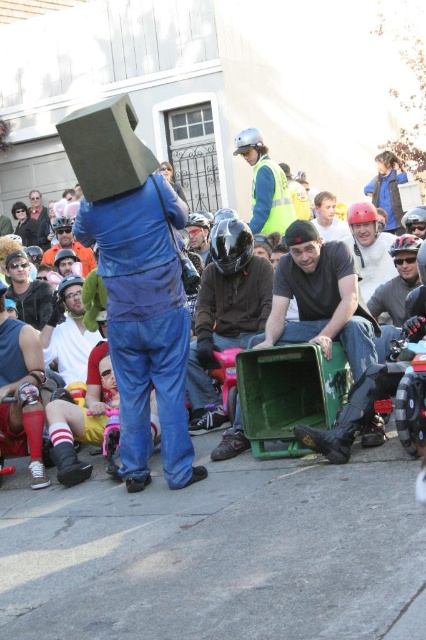
Does gray concrete pavement at lower center come in front of reflective yellow vest at upper center?

Yes.

Is gray concrete pavement at lower center to the right of reflective yellow vest at upper center from the viewer's perspective?

In fact, gray concrete pavement at lower center is to the left of reflective yellow vest at upper center.

Between point (19, 490) and point (258, 141), which one is positioned in front?

Positioned in front is point (19, 490).

Find the location of a particular element. Image resolution: width=426 pixels, height=640 pixels. gray concrete pavement at lower center is located at coordinates (218, 554).

Does red socked leg at lower left appear on the right side of reflective yellow vest at upper center?

Incorrect, red socked leg at lower left is not on the right side of reflective yellow vest at upper center.

Is the position of red socked leg at lower left more distant than that of reflective yellow vest at upper center?

That is False.

The width and height of the screenshot is (426, 640). I want to click on red socked leg at lower left, so click(20, 394).

Between matte blue jumpsuit at center and reflective yellow vest at upper center, which one has more height?

Standing taller between the two is reflective yellow vest at upper center.

Who is higher up, matte blue jumpsuit at center or reflective yellow vest at upper center?

Positioned higher is reflective yellow vest at upper center.

Who is more distant from viewer, (100, 248) or (271, 182)?

The point (271, 182) is more distant.

In order to click on matte blue jumpsuit at center in this screenshot , I will do `click(144, 323)`.